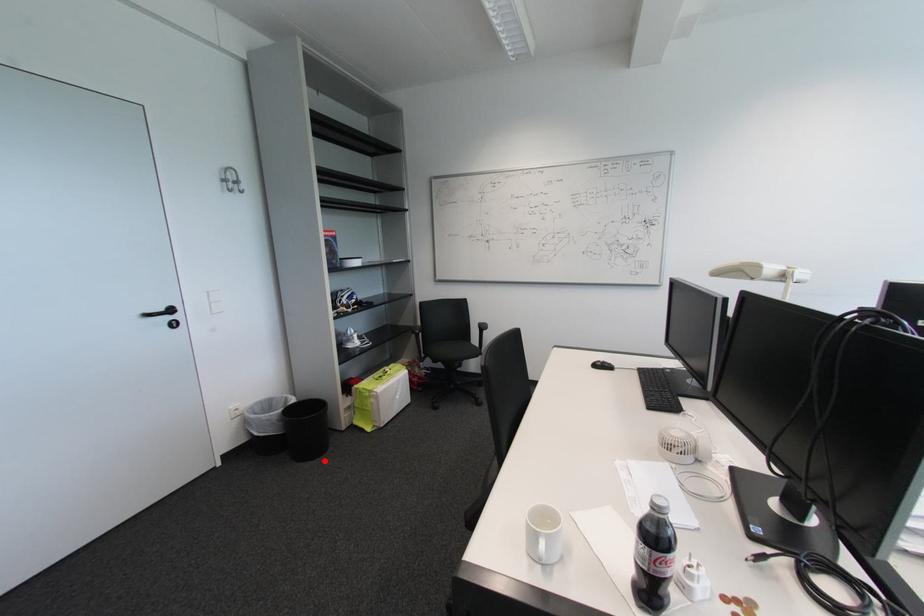
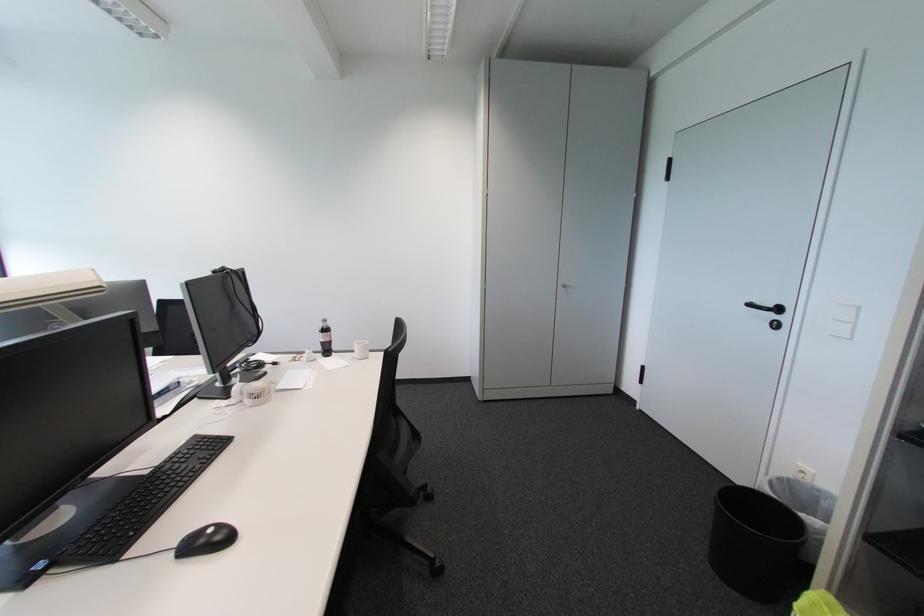
Question: I am providing you with two images of the same scene from different viewpoints. Image1 has a red point marked. In image2, the corresponding 3D location appears at what relative position? Reply with the corresponding letter.

Choices:
 (A) Closer
 (B) Farther

Answer: (A)